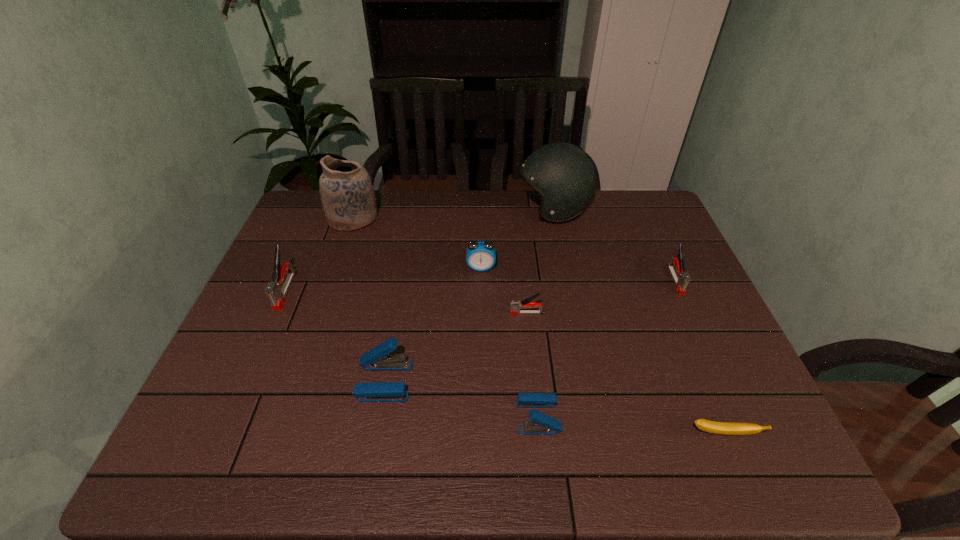
Image resolution: width=960 pixels, height=540 pixels. In order to click on vacant area that satisfies the following two spatial constraints: 1. on the handle side of the right blue stapler; 2. on the right side of the nearest gray stapler in this screenshot , I will do pyautogui.click(x=538, y=417).